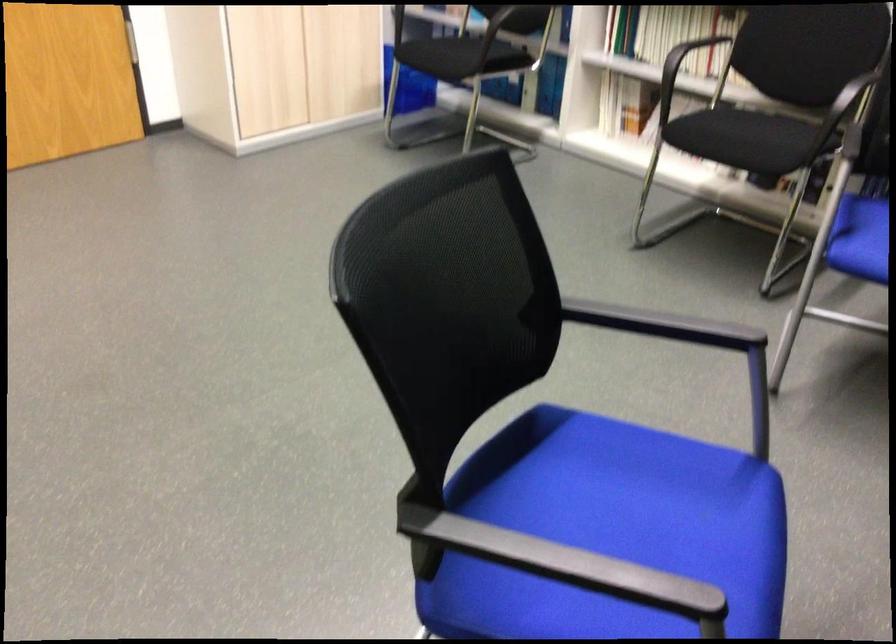
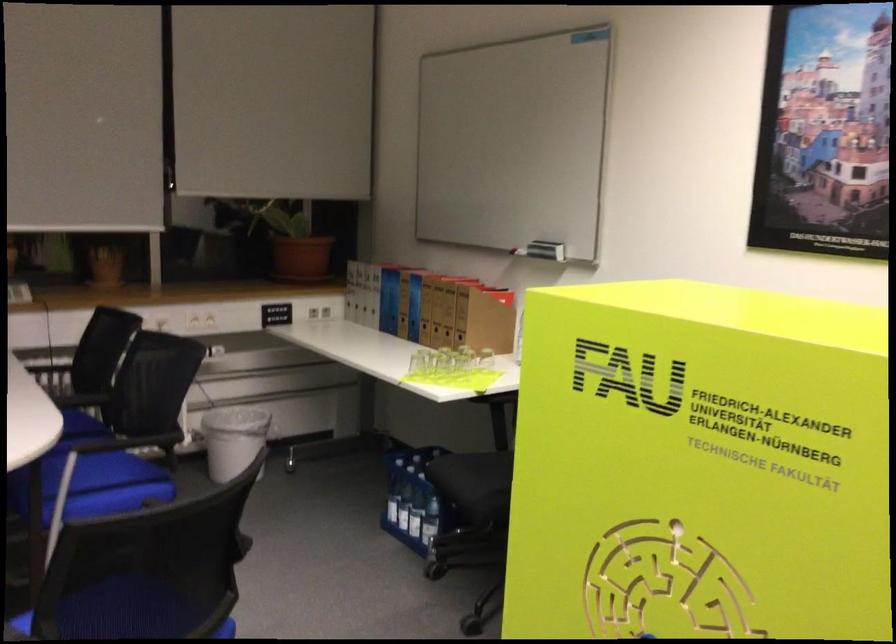
Question: I am providing you with two images of the same scene from different viewpoints. Which of the following objects are not visible in image2?

Choices:
 (A) black chair sitting surface
 (B) red capped bottle
 (C) chair armrest
 (D) whiteboard eraser holder

Answer: (C)